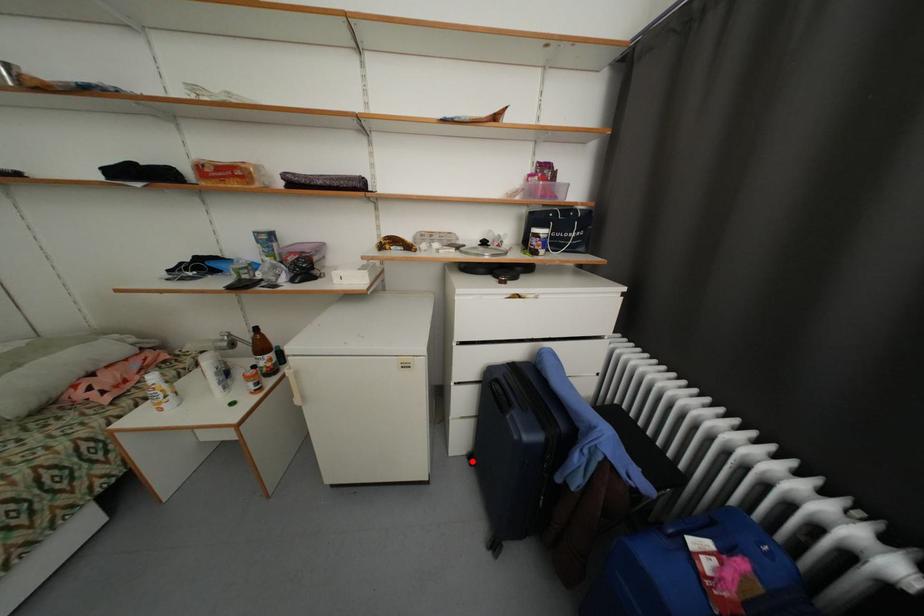
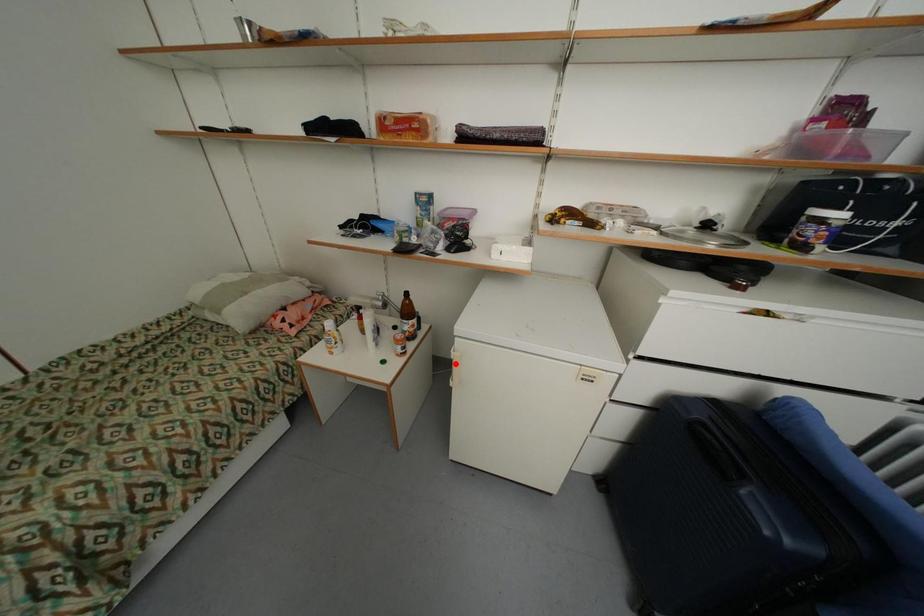
I am providing you with two images of the same scene from different viewpoints. A red point is marked on the first image and another point is marked on the second image. Does the point marked in image1 correspond to the same location as the one in image2?

No